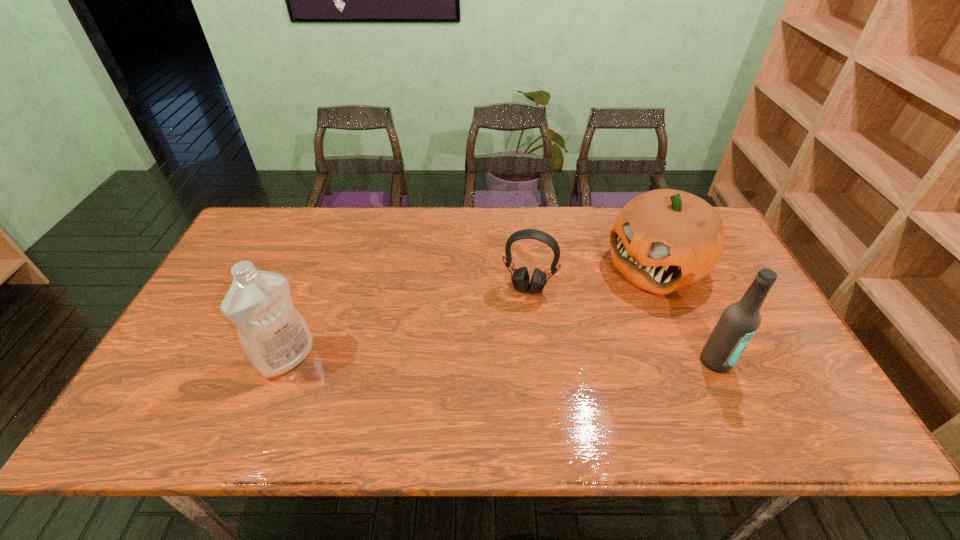
You are a GUI agent. You are given a task and a screenshot of the screen. Output one action in this format:
    pyautogui.click(x=<x>, y=<y>)
    Task: Click on the blank space located 0.090m on the front-facing side of the headset
    The width and height of the screenshot is (960, 540).
    Given the screenshot: What is the action you would take?
    pyautogui.click(x=516, y=321)

Where is `free space located on the front-facing side of the headset`? free space located on the front-facing side of the headset is located at coordinates (505, 363).

Identify the location of object that is at the far edge. (662, 240).

Locate an element on the screen. Image resolution: width=960 pixels, height=540 pixels. detergent situated at the near edge is located at coordinates (275, 338).

At what (x,y) coordinates should I click in order to perform the action: click on beer bottle at the near edge. Please return your answer as a coordinate pair (x, y). Looking at the image, I should click on (739, 322).

The image size is (960, 540). In order to click on beer bottle at the right edge in this screenshot , I will do `click(739, 322)`.

The width and height of the screenshot is (960, 540). What are the coordinates of `pumpkin that is at the right edge` in the screenshot? It's located at (662, 240).

At what (x,y) coordinates should I click in order to perform the action: click on object that is at the far right corner. Please return your answer as a coordinate pair (x, y). This screenshot has height=540, width=960. Looking at the image, I should click on (662, 240).

Identify the location of object located at the near right corner. (739, 322).

Locate an element on the screen. This screenshot has width=960, height=540. free space at the far edge of the desktop is located at coordinates (409, 242).